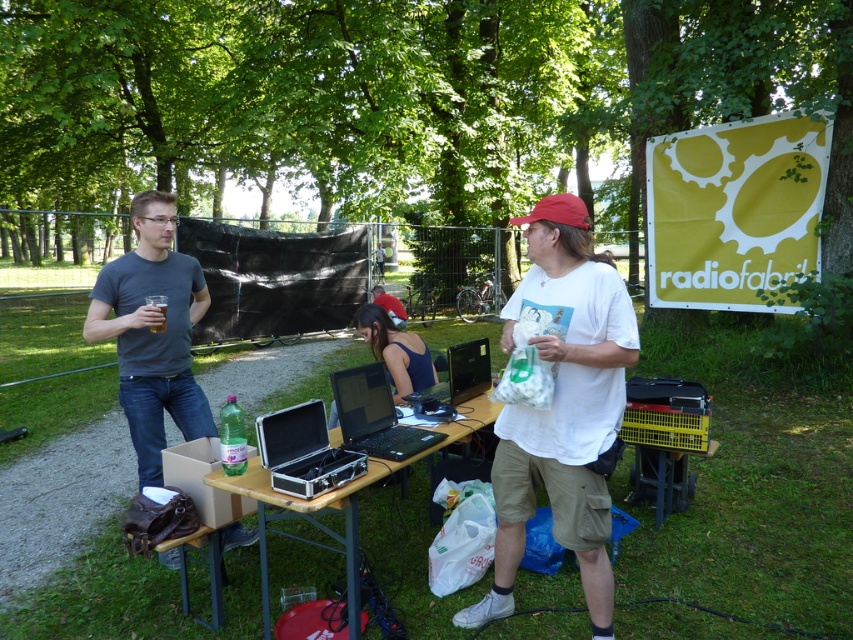
Does gray matte t-shirt at left have a greater width compared to black glossy laptop at center?

Yes.

Is gray matte t-shirt at left bigger than black glossy laptop at center?

Yes, gray matte t-shirt at left is bigger than black glossy laptop at center.

Is point (161, 234) behind point (461, 356)?

That is False.

Locate an element on the screen. gray matte t-shirt at left is located at coordinates (154, 332).

Between point (137, 280) and point (210, 593), which one is positioned in front?

Point (210, 593)

This screenshot has width=853, height=640. In order to click on gray matte t-shirt at left in this screenshot , I will do click(154, 332).

Measure the distance between white matte t-shirt at center and black glossy laptop at center.

white matte t-shirt at center and black glossy laptop at center are 1.07 meters apart.

Can you confirm if white matte t-shirt at center is smaller than black glossy laptop at center?

No.

Does point (576, 552) come farther from viewer compared to point (454, 388)?

No, it is in front of (454, 388).

Where is `white matte t-shirt at center`? Image resolution: width=853 pixels, height=640 pixels. white matte t-shirt at center is located at coordinates (561, 406).